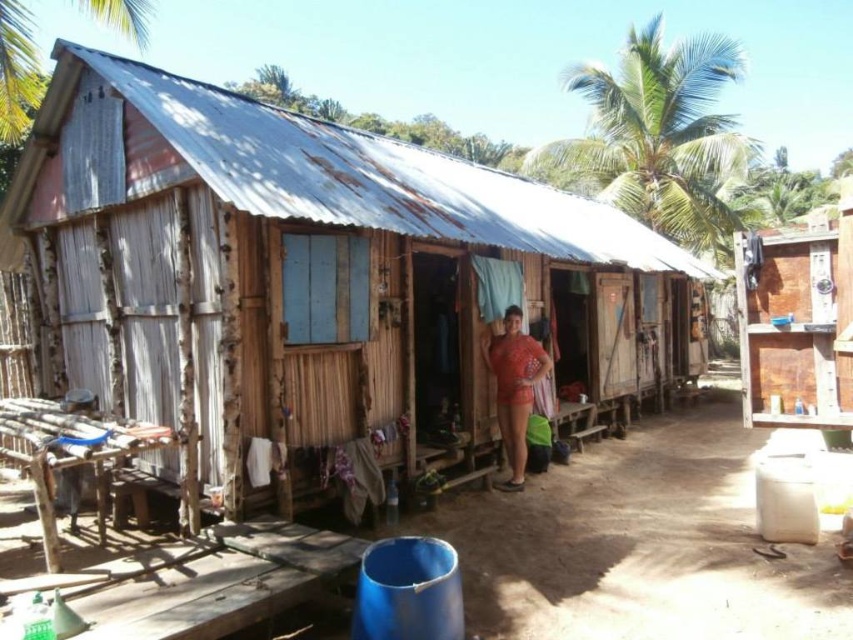
You are standing outside the rustic wooden structure and notice the green leafy palm tree at upper center and the matte red shorts at center. Which object is bigger in size?

The green leafy palm tree at upper center is larger in size compared to the matte red shorts at center.

You are planning to take a photo of the rusty corrugated metal hut at center and the green leafy palm tree at upper right. Which object should you focus on first if you want to capture both in the same frame without moving the camera?

The rusty corrugated metal hut at center is smaller than the green leafy palm tree at upper right, so you should focus on the green leafy palm tree at upper right first to ensure both fit in the frame.

You are standing in front of the rustic wooden structure and notice two points marked in the scene. Which of the two points, point [131,1] or point [512,371], is closer to you?

Point [131,1] is closer to you because it is further to the viewer than point [512,371].